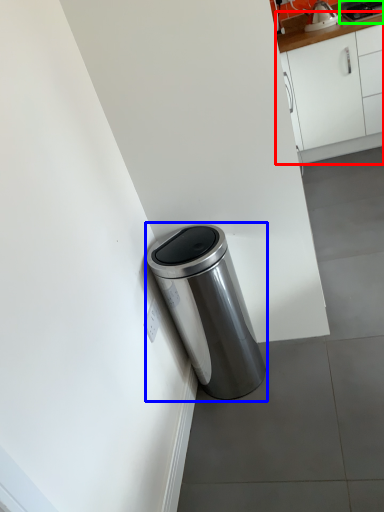
Question: Which is farther away from cabinetry (highlighted by a red box)? waste container (highlighted by a blue box) or appliance (highlighted by a green box)?

Choices:
 (A) waste container
 (B) appliance

Answer: (A)